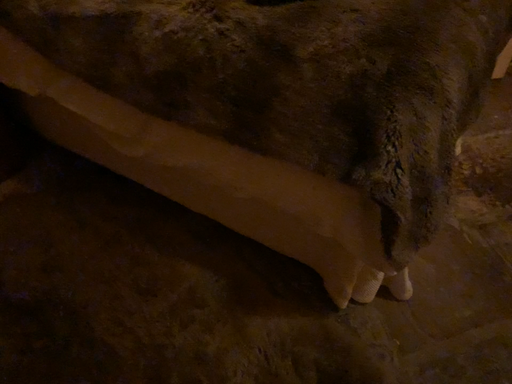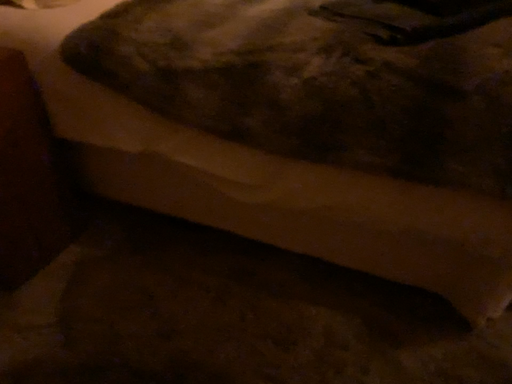
Question: Which way did the camera rotate in the video?

Choices:
 (A) rotated left
 (B) rotated right

Answer: (B)